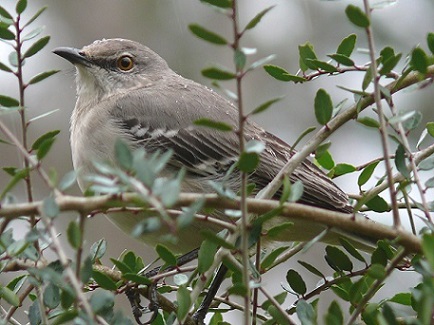
At what (x,y) coordinates should I click in order to perform the action: click on chest. Please return your answer as a coordinate pair (x, y). This screenshot has width=434, height=325. Looking at the image, I should click on (93, 140).